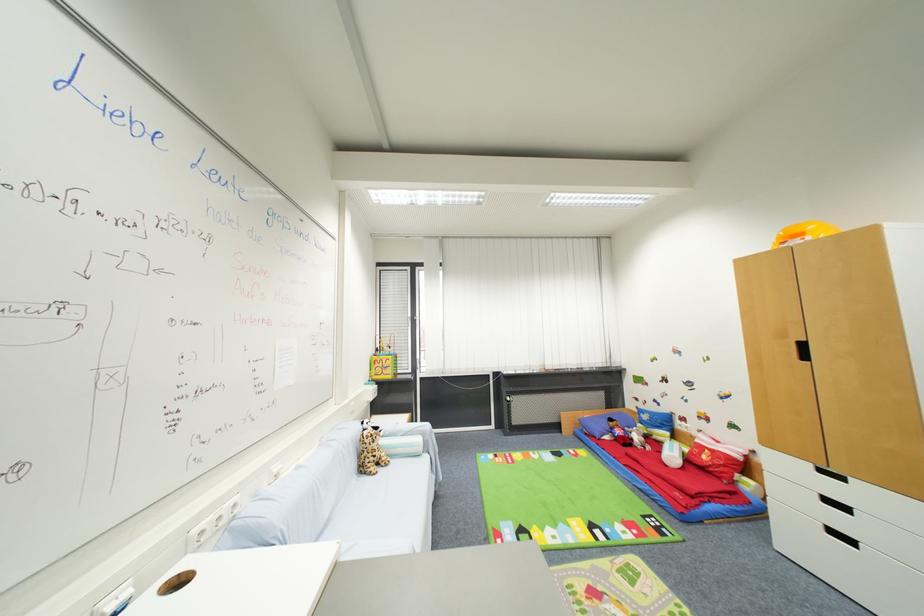
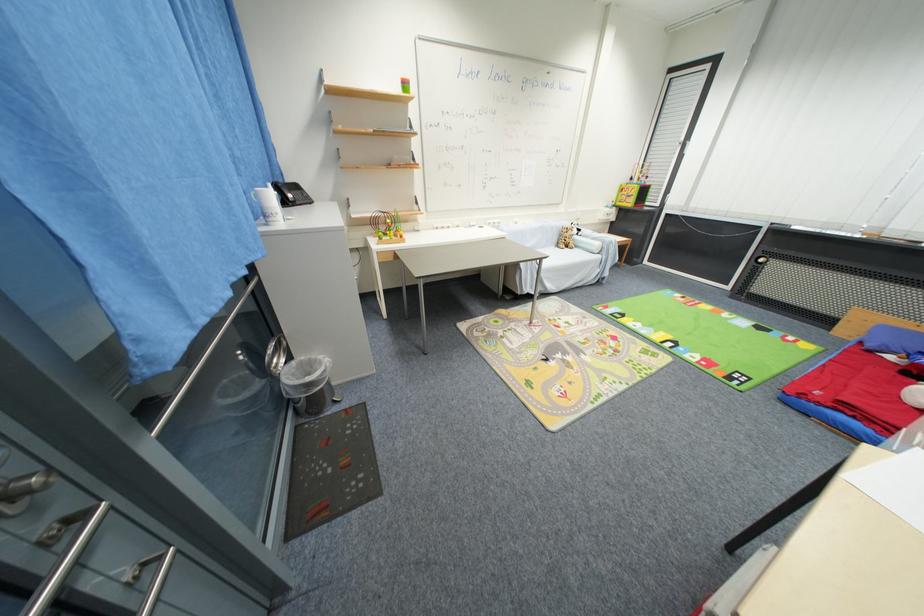
Where in the second image is the point corresponding to point 385,472 from the first image?

(572, 251)